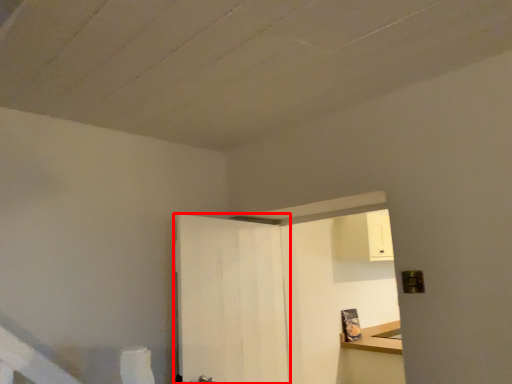
Question: Observing the image, what is the correct spatial positioning of door (annotated by the red box) in reference to dresser?

Choices:
 (A) left
 (B) right

Answer: (A)